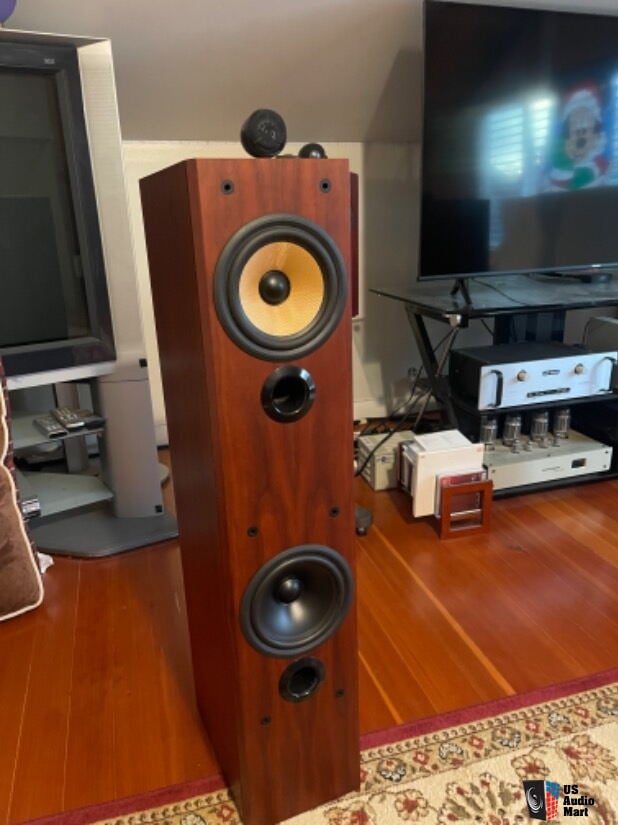
Locate an element on the screen. The width and height of the screenshot is (618, 825). wood floor is located at coordinates (548, 653).